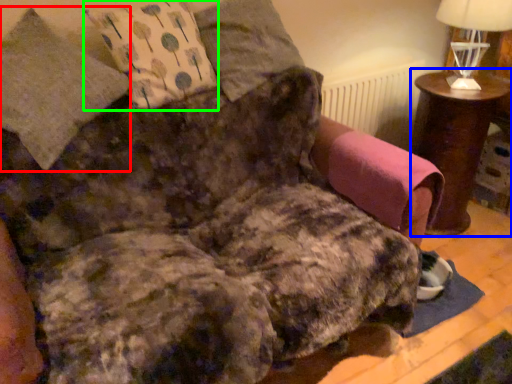
Question: Which object is positioned farthest from pillow (highlighted by a red box)? Select from table (highlighted by a blue box) and throw pillow (highlighted by a green box).

Choices:
 (A) table
 (B) throw pillow

Answer: (A)